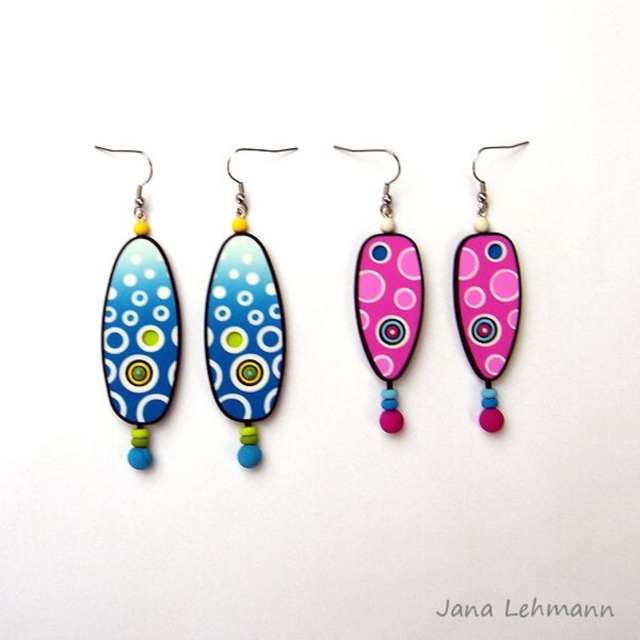
You are a jewelry designer trying to create a matching necklace. You have the matte blue polymer clay earring at left and the pink glossy teardrop at center. Which one should you base the necklace design on to ensure it complements the larger earring?

You should base the necklace design on the matte blue polymer clay earring at left because it is larger in size than the pink glossy teardrop at center, ensuring the necklace complements the scale of the larger earring.

You are a jeweler trying to fit both the pink glossy earring at center and the pink glossy teardrop at center into a narrow display case. Which object should you place first to ensure they both fit?

The pink glossy teardrop at center has a smaller width than the pink glossy earring at center, so you should place the pink glossy earring at center first to ensure there is enough space for the narrower teardrop.